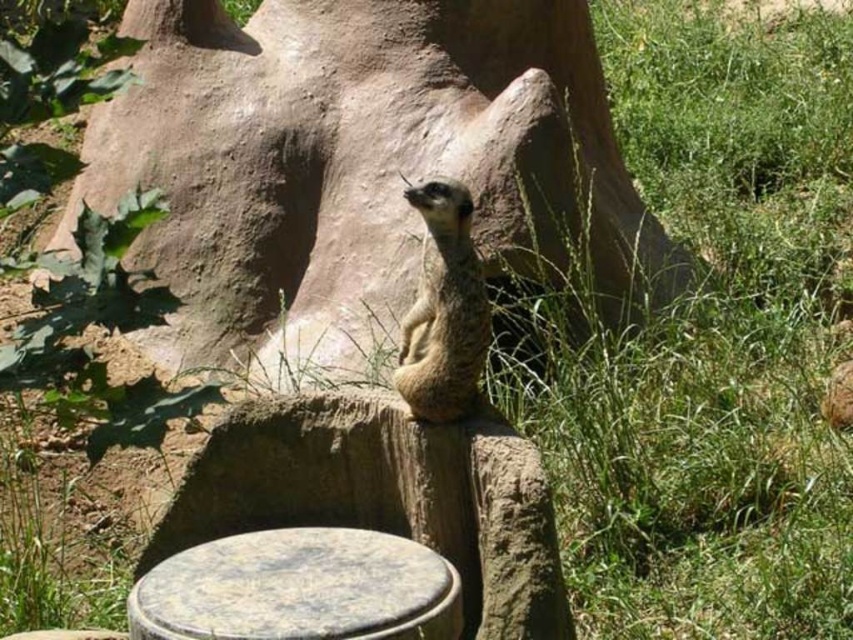
Question: Which point is closer to the camera?

Choices:
 (A) speckled stone stool at center
 (B) furry brown meerkat at center

Answer: (A)

Question: Can you confirm if speckled stone stool at center is positioned to the left of furry brown meerkat at center?

Choices:
 (A) yes
 (B) no

Answer: (A)

Question: From the image, what is the correct spatial relationship of speckled stone stool at center in relation to furry brown meerkat at center?

Choices:
 (A) above
 (B) below

Answer: (B)

Question: Does speckled stone stool at center have a smaller size compared to furry brown meerkat at center?

Choices:
 (A) no
 (B) yes

Answer: (A)